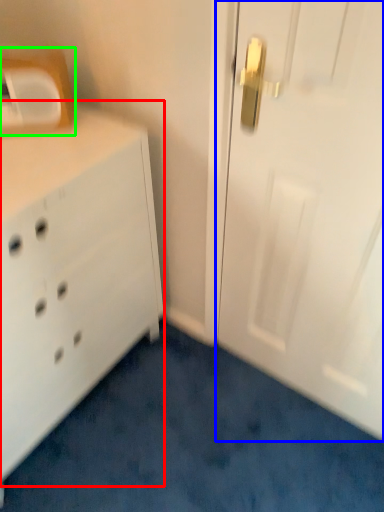
Question: Which is farther away from chest of drawers (highlighted by a red box)? door (highlighted by a blue box) or medicine cabinet (highlighted by a green box)?

Choices:
 (A) door
 (B) medicine cabinet

Answer: (A)